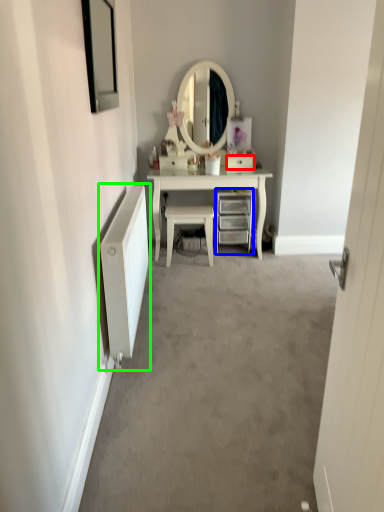
Question: Which object is the farthest from drawer (highlighted by a red box)? Choose among these: chest of drawers (highlighted by a blue box) or radiator (highlighted by a green box).

Choices:
 (A) chest of drawers
 (B) radiator

Answer: (B)